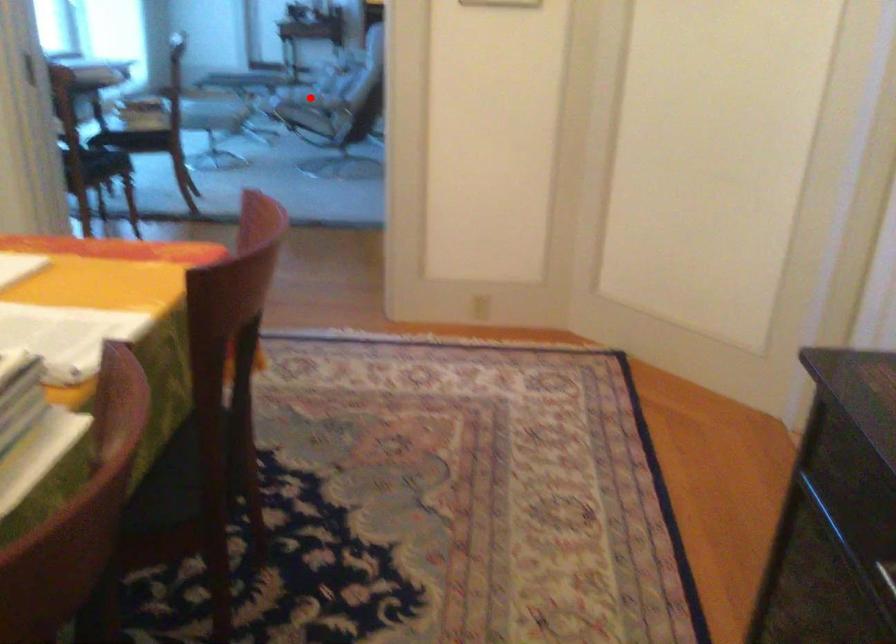
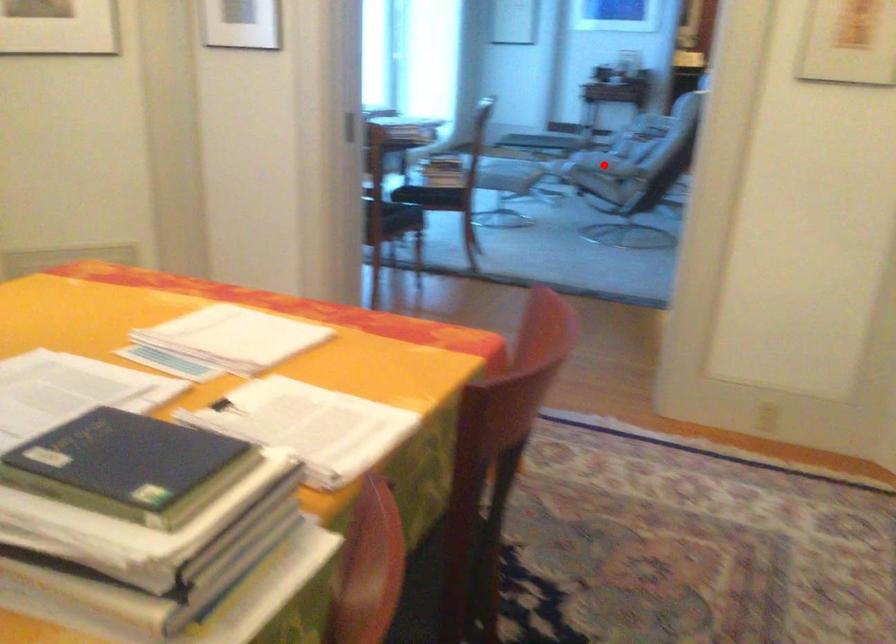
I am providing you with two images of the same scene from different viewpoints. A red point is marked on the first image and another point is marked on the second image. Is the marked point in image1 the same physical position as the marked point in image2?

Yes